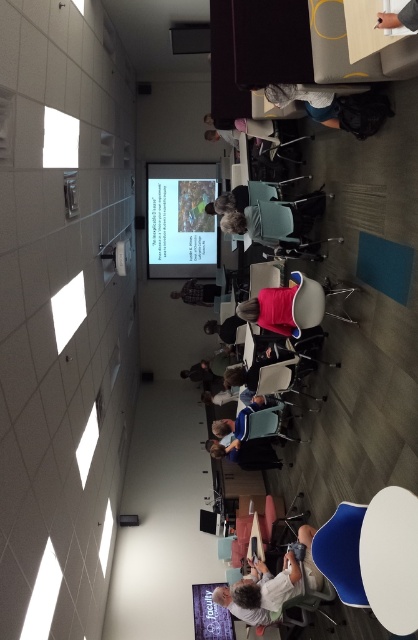
You are an event organizer who needs to ensure that all attendees can see the matte plastic projector screen at upper center clearly. Considering the dark gray fabric jacket at center, which object is bigger and might block the view if someone is sitting behind it?

The matte plastic projector screen at upper center is larger than the dark gray fabric jacket at center. Since the projector screen is bigger, it is less likely to be blocked by the jacket. However, the jacket itself could potentially block the view for someone sitting behind it if they are very close.